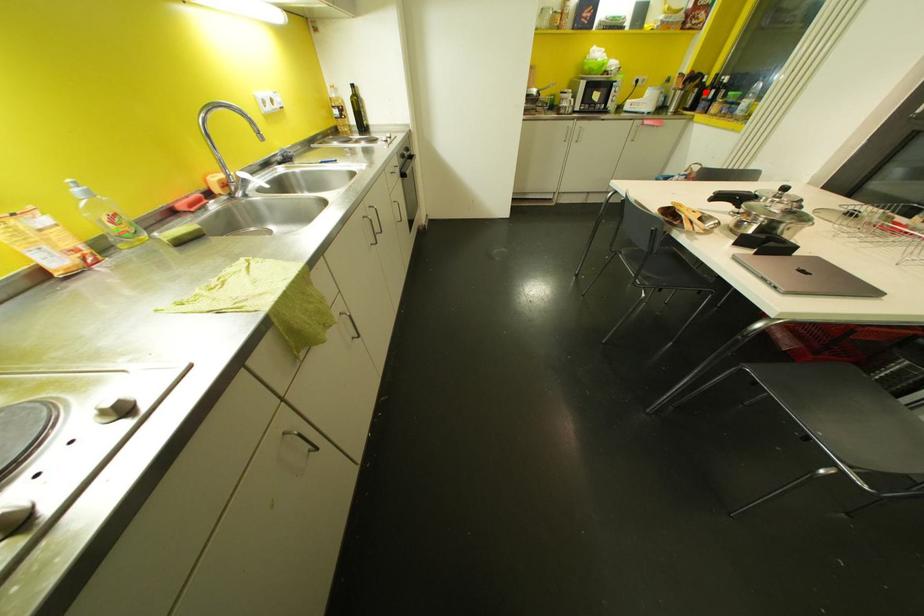
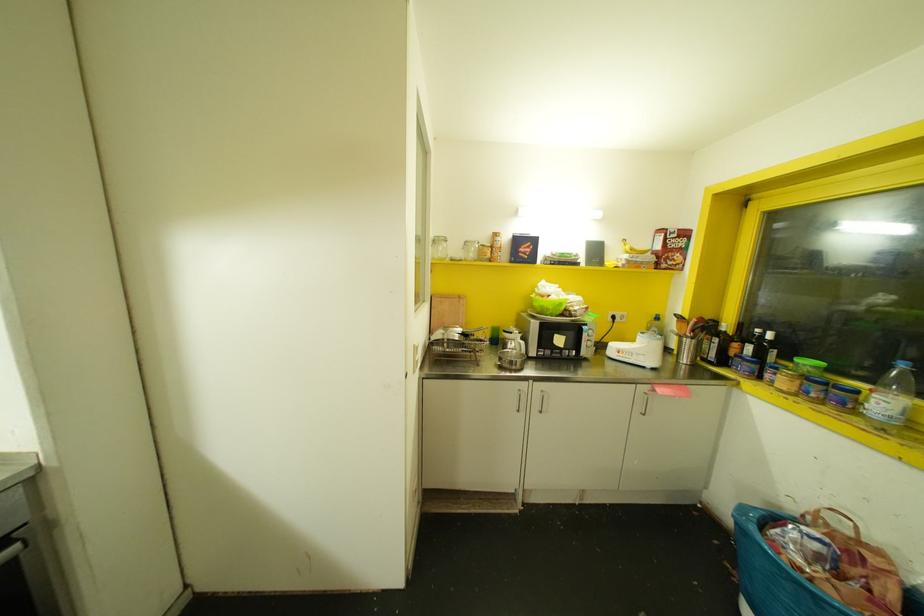
The point at the highlighted location is marked in the first image. Where is the corresponding point in the second image?

(735, 345)